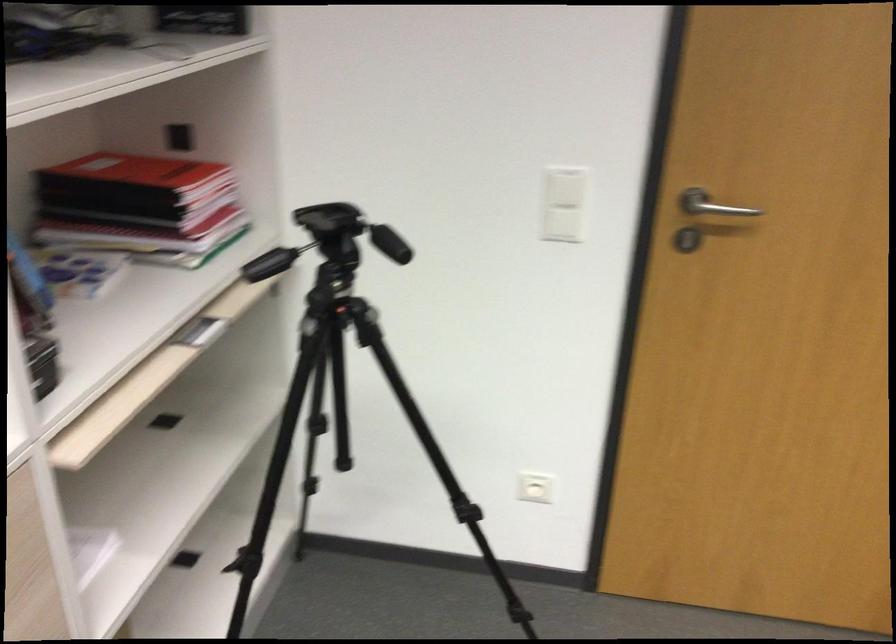
Where would you flip the tripod leg lock? Please return your answer as a coordinate pair (x, y).

(334, 313)